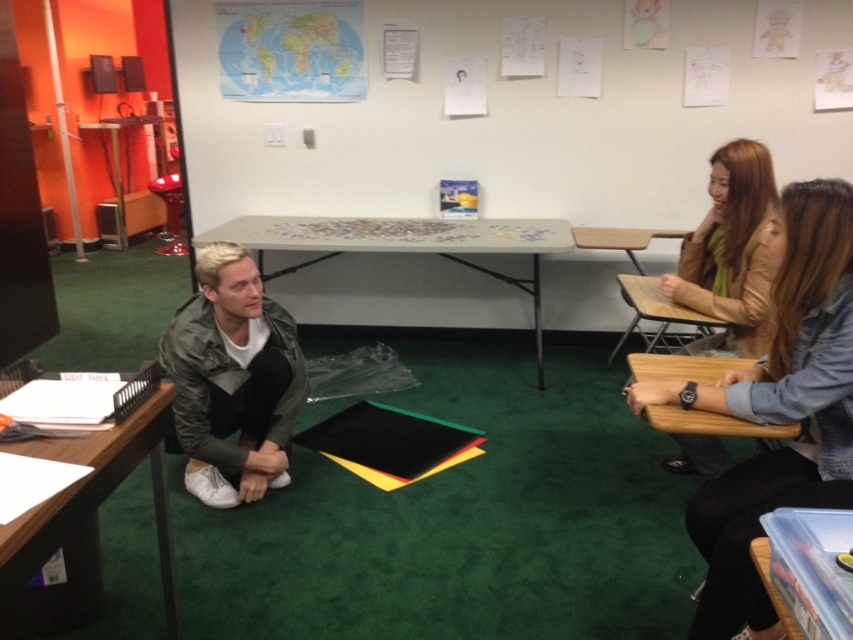
You are standing in the classroom and want to place a large poster on the nearest surface. Which object should you choose between the beige plastic table at center and the wooden desk at right?

The beige plastic table at center is closer to the viewer than the wooden desk at right, so you should choose the beige plastic table at center as the nearest surface to place the large poster.

What object is located at the coordinate point (x=403, y=244) in the image?

The beige plastic table at center is located at the coordinate point (x=403, y=244).